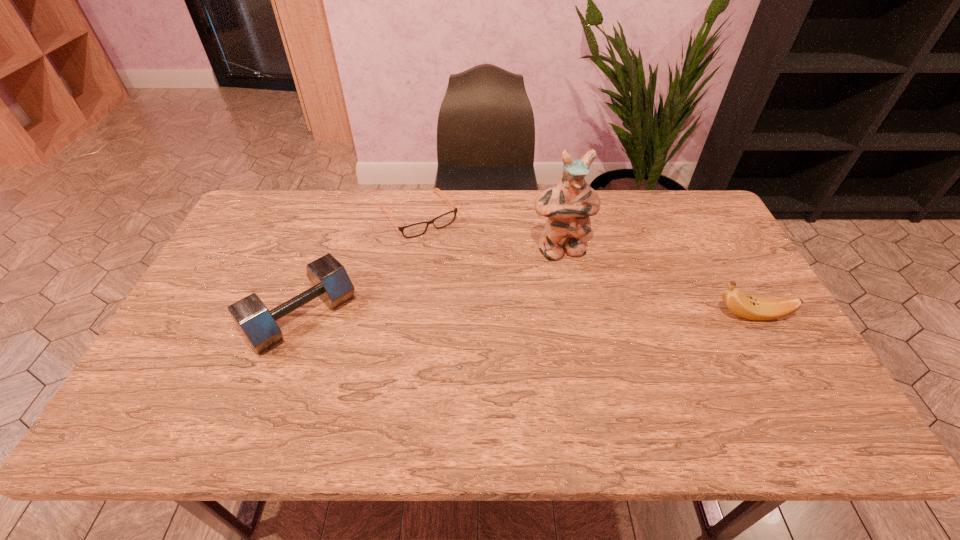
Find the location of a particular element. This screenshot has height=540, width=960. free spot located 0.180m on the front-facing side of the tallest object is located at coordinates (588, 308).

At what (x,y) coordinates should I click in order to perform the action: click on vacant space situated 0.130m on the front-facing side of the tallest object. Please return your answer as a coordinate pair (x, y). Looking at the image, I should click on (583, 295).

I want to click on free space located 0.090m on the front-facing side of the tallest object, so click(x=578, y=285).

At what (x,y) coordinates should I click in order to perform the action: click on object that is at the far edge. Please return your answer as a coordinate pair (x, y). This screenshot has width=960, height=540. Looking at the image, I should click on (417, 229).

The width and height of the screenshot is (960, 540). Find the location of `object present at the right edge`. object present at the right edge is located at coordinates (754, 308).

In the image, there is a desktop. Identify the location of free space at the far edge. The width and height of the screenshot is (960, 540). (374, 197).

Where is `free space at the near edge of the desktop`? free space at the near edge of the desktop is located at coordinates (353, 381).

In the image, there is a desktop. Identify the location of free space at the left edge. The width and height of the screenshot is (960, 540). (208, 297).

Image resolution: width=960 pixels, height=540 pixels. In the image, there is a desktop. Find the location of `vacant region at the right edge`. vacant region at the right edge is located at coordinates (707, 256).

What are the coordinates of `vacant space at the far left corner of the desktop` in the screenshot? It's located at (266, 220).